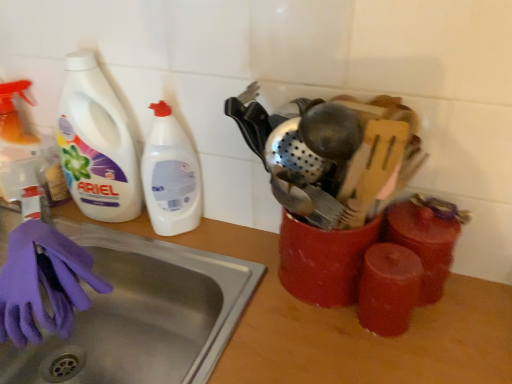
Find the location of a particular element. vacant area that is in front of white plastic bottle at left is located at coordinates (185, 270).